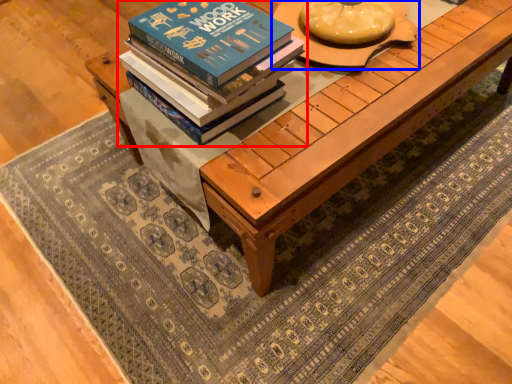
Question: Which object appears farthest to the camera in this image, book (highlighted by a red box) or round table (highlighted by a blue box)?

Choices:
 (A) book
 (B) round table

Answer: (B)